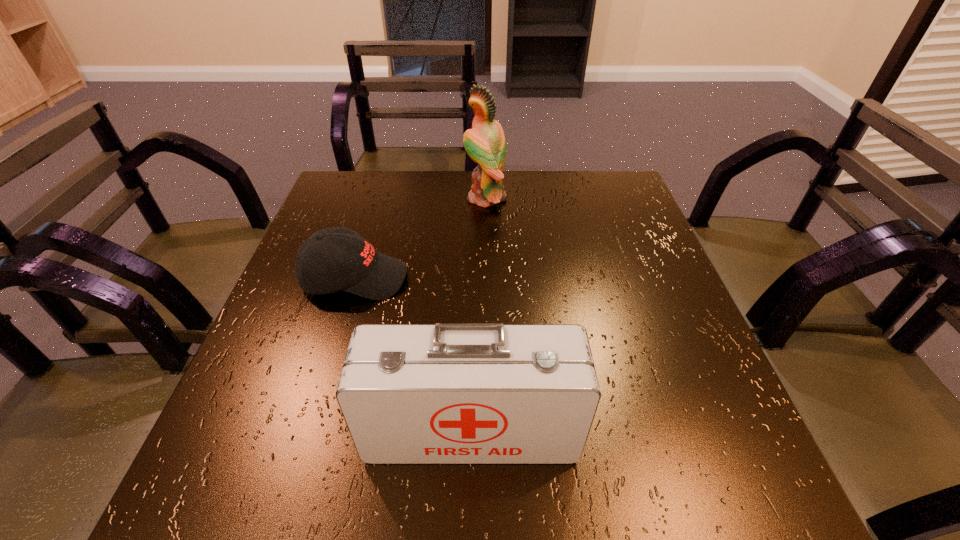
Identify the location of vacant space that's between the farthest object and the nearest object. [x=478, y=315].

Find the location of a particular element. The width and height of the screenshot is (960, 540). unoccupied position between the shortest object and the farthest object is located at coordinates (420, 238).

Where is `free space between the baseball cap and the farthest object`? The image size is (960, 540). free space between the baseball cap and the farthest object is located at coordinates (420, 238).

Where is `blank region between the parrot and the shortest object`? Image resolution: width=960 pixels, height=540 pixels. blank region between the parrot and the shortest object is located at coordinates (420, 238).

Find the location of a particular element. The height and width of the screenshot is (540, 960). empty space between the first-aid kit and the parrot is located at coordinates (478, 315).

This screenshot has width=960, height=540. Identify the location of empty location between the parrot and the nearest object. (478, 315).

Identify the location of free point between the farthest object and the nearest object. The image size is (960, 540). click(478, 315).

The image size is (960, 540). Identify the location of object identified as the closest to the nearest object. (361, 270).

Select which object appears as the second closest to the second tallest object. Please provide its 2D coordinates. Your answer should be formatted as a tuple, i.e. [(x, y)], where the tuple contains the x and y coordinates of a point satisfying the conditions above.

[(485, 143)]

I want to click on vacant space that satisfies the following two spatial constraints: 1. on the front-facing side of the tallest object; 2. on the front-facing side of the second tallest object, so click(x=490, y=431).